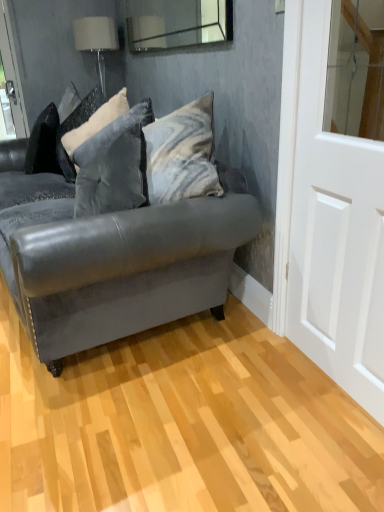
Describe the element at coordinates (96, 41) in the screenshot. I see `white fabric lampshade at upper left` at that location.

This screenshot has height=512, width=384. What do you see at coordinates (111, 259) in the screenshot?
I see `matte gray leather couch at center` at bounding box center [111, 259].

The height and width of the screenshot is (512, 384). What do you see at coordinates (96, 122) in the screenshot? I see `velvet gray pillow at upper left, arranged as the first pillow when viewed from the back` at bounding box center [96, 122].

Find the location of a particular element. Image resolution: width=384 pixels, height=512 pixels. white fabric lampshade at upper left is located at coordinates (96, 41).

Could matte gray leather couch at center be considered to be inside clear glass mirror at upper center?

No, clear glass mirror at upper center does not contain matte gray leather couch at center.

Is clear glass mirror at upper center at the left side of matte gray leather couch at center?

Incorrect, clear glass mirror at upper center is not on the left side of matte gray leather couch at center.

Is clear glass mirror at upper center bigger or smaller than matte gray leather couch at center?

Clearly, clear glass mirror at upper center is smaller in size than matte gray leather couch at center.

Where is `pillow that is the 1st object above the matte gray leather couch at center (from a real-world perspective)`? The width and height of the screenshot is (384, 512). pillow that is the 1st object above the matte gray leather couch at center (from a real-world perspective) is located at coordinates (114, 165).

Which is behind, point (130, 180) or point (79, 268)?

Point (130, 180)

Is matte gray leather couch at center located within velvet gray pillow at center, placed as the first pillow when sorted from front to back?

No, matte gray leather couch at center is located outside of velvet gray pillow at center, placed as the first pillow when sorted from front to back.

How many degrees apart are the facing directions of velvet gray pillow at center, placed as the 2th pillow when sorted from back to front, and matte gray leather couch at center?

The angle between the facing direction of velvet gray pillow at center, placed as the 2th pillow when sorted from back to front, and the facing direction of matte gray leather couch at center is 0.000167 degrees.

Is velvet gray pillow at center, placed as the first pillow when sorted from front to back, smaller than velvet gray pillow at upper left, positioned as the second pillow in front-to-back order?

No.

From the image's perspective, which object appears higher, velvet gray pillow at center, placed as the first pillow when sorted from front to back, or velvet gray pillow at upper left, positioned as the second pillow in front-to-back order?

velvet gray pillow at upper left, positioned as the second pillow in front-to-back order, is shown above in the image.

From a real-world perspective, is velvet gray pillow at center, placed as the 2th pillow when sorted from back to front, physically located above or below velvet gray pillow at upper left, arranged as the first pillow when viewed from the back?

Clearly, from a real-world perspective, velvet gray pillow at center, placed as the 2th pillow when sorted from back to front, is below velvet gray pillow at upper left, arranged as the first pillow when viewed from the back.

Does velvet gray pillow at center, placed as the first pillow when sorted from front to back, have a greater width compared to velvet gray pillow at upper left, positioned as the second pillow in front-to-back order?

Yes.

From the image's perspective, is white fabric lampshade at upper left below clear glass mirror at upper center?

No.

Is white fabric lampshade at upper left next to clear glass mirror at upper center and touching it?

No.

From a real-world perspective, is white fabric lampshade at upper left below clear glass mirror at upper center?

Yes, from a real-world perspective, white fabric lampshade at upper left is under clear glass mirror at upper center.

Is white fabric lampshade at upper left facing away from clear glass mirror at upper center?

No, clear glass mirror at upper center is not at the back of white fabric lampshade at upper left.

Is white fabric lampshade at upper left taller or shorter than velvet gray pillow at upper left, arranged as the first pillow when viewed from the back?

Considering their sizes, white fabric lampshade at upper left has less height than velvet gray pillow at upper left, arranged as the first pillow when viewed from the back.

From a real-world perspective, is white fabric lampshade at upper left on top of velvet gray pillow at upper left, arranged as the first pillow when viewed from the back?

Yes, from a real-world perspective, white fabric lampshade at upper left is on top of velvet gray pillow at upper left, arranged as the first pillow when viewed from the back.

Is white fabric lampshade at upper left behind velvet gray pillow at upper left, arranged as the first pillow when viewed from the back?

Yes, it is behind velvet gray pillow at upper left, arranged as the first pillow when viewed from the back.

Considering the positions of point (201, 302) and point (104, 59), is point (201, 302) closer or farther from the camera than point (104, 59)?

Clearly, point (201, 302) is closer to the camera than point (104, 59).

Between matte gray leather couch at center and white fabric lampshade at upper left, which one appears on the left side from the viewer's perspective?

white fabric lampshade at upper left.

Which object is closer to the camera, matte gray leather couch at center or white fabric lampshade at upper left?

matte gray leather couch at center is closer to the camera.

Are matte gray leather couch at center and white fabric lampshade at upper left far apart?

That's right, there is a large distance between matte gray leather couch at center and white fabric lampshade at upper left.

Is velvet gray pillow at center, placed as the first pillow when sorted from front to back, bigger or smaller than clear glass mirror at upper center?

velvet gray pillow at center, placed as the first pillow when sorted from front to back, is bigger than clear glass mirror at upper center.

Can you confirm if velvet gray pillow at center, placed as the first pillow when sorted from front to back, is positioned to the left of clear glass mirror at upper center?

Yes, velvet gray pillow at center, placed as the first pillow when sorted from front to back, is to the left of clear glass mirror at upper center.

Which is behind, velvet gray pillow at center, placed as the 2th pillow when sorted from back to front, or clear glass mirror at upper center?

Positioned behind is velvet gray pillow at center, placed as the 2th pillow when sorted from back to front.

Where is `mirror behind the matte gray leather couch at center`? Image resolution: width=384 pixels, height=512 pixels. mirror behind the matte gray leather couch at center is located at coordinates (178, 23).

At what (x,y) coordinates should I click in order to perform the action: click on studio couch that appears below the velvet gray pillow at center, placed as the 2th pillow when sorted from back to front (from a real-world perspective). Please return your answer as a coordinate pair (x, y). The width and height of the screenshot is (384, 512). Looking at the image, I should click on (111, 259).

Estimate the real-world distances between objects in this image. Which object is further from white glossy door at right, white fabric lampshade at upper left or velvet gray pillow at center, placed as the 2th pillow when sorted from back to front?

white fabric lampshade at upper left is further to white glossy door at right.

Looking at the image, which one is located closer to white glossy door at right, clear glass mirror at upper center or white fabric lampshade at upper left?

Based on the image, clear glass mirror at upper center appears to be nearer to white glossy door at right.

Considering their positions, is white fabric lampshade at upper left positioned closer to white glossy door at right than matte gray leather couch at center?

matte gray leather couch at center is closer to white glossy door at right.

Based on their spatial positions, is white fabric lampshade at upper left or velvet gray pillow at center, placed as the first pillow when sorted from front to back, closer to matte gray leather couch at center?

velvet gray pillow at center, placed as the first pillow when sorted from front to back.

Looking at the image, which one is located further to velvet gray pillow at center, placed as the 2th pillow when sorted from back to front, white fabric lampshade at upper left or white glossy door at right?

white fabric lampshade at upper left lies further to velvet gray pillow at center, placed as the 2th pillow when sorted from back to front, than the other object.

When comparing their distances from clear glass mirror at upper center, does white fabric lampshade at upper left or white glossy door at right seem further?

The object further to clear glass mirror at upper center is white glossy door at right.

Which object lies further to the anchor point white glossy door at right, velvet gray pillow at center, placed as the first pillow when sorted from front to back, or clear glass mirror at upper center?

The object further to white glossy door at right is clear glass mirror at upper center.

Based on their spatial positions, is matte gray leather couch at center or clear glass mirror at upper center closer to velvet gray pillow at upper left, positioned as the second pillow in front-to-back order?

Among the two, matte gray leather couch at center is located nearer to velvet gray pillow at upper left, positioned as the second pillow in front-to-back order.

Image resolution: width=384 pixels, height=512 pixels. What are the coordinates of `mirror positioned between matte gray leather couch at center and velvet gray pillow at upper left, positioned as the second pillow in front-to-back order, from near to far` in the screenshot? It's located at pyautogui.click(x=178, y=23).

Locate an element on the screen. This screenshot has width=384, height=512. mirror between matte gray leather couch at center and white fabric lampshade at upper left in the front-back direction is located at coordinates (178, 23).

The height and width of the screenshot is (512, 384). What are the coordinates of `pillow between clear glass mirror at upper center and velvet gray pillow at center, placed as the first pillow when sorted from front to back, from top to bottom` in the screenshot? It's located at (96, 122).

Identify the location of studio couch positioned between white glossy door at right and white fabric lampshade at upper left from near to far. This screenshot has height=512, width=384. (111, 259).